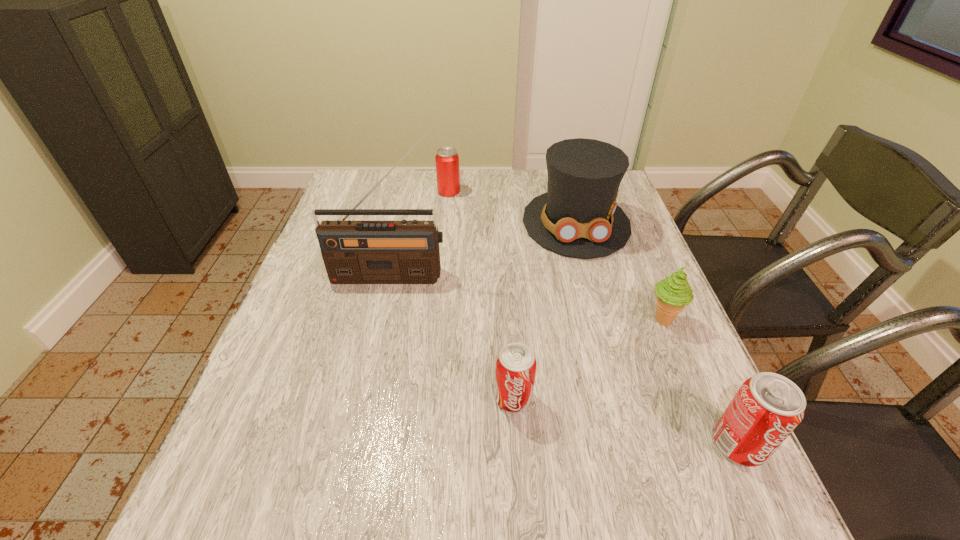
This screenshot has width=960, height=540. Identify the location of dress hat at the right edge. (578, 216).

Locate an element on the screen. icecream situated at the right edge is located at coordinates (673, 293).

Identify the location of object positioned at the far right corner. (578, 216).

Locate an element on the screen. object located in the near right corner section of the desktop is located at coordinates (766, 409).

This screenshot has width=960, height=540. Identify the location of vacant region at the far edge. coord(536,189).

This screenshot has height=540, width=960. In the image, there is a desktop. Find the location of `vacant space at the near edge`. vacant space at the near edge is located at coordinates (582, 438).

In the image, there is a desktop. Where is `free space at the left edge`? free space at the left edge is located at coordinates (264, 406).

What are the coordinates of `free location at the right edge` in the screenshot? It's located at (609, 295).

This screenshot has width=960, height=540. I want to click on free space at the near right corner of the desktop, so click(x=680, y=430).

Locate an element on the screen. This screenshot has height=540, width=960. free spot between the nearest object and the dress hat is located at coordinates (658, 334).